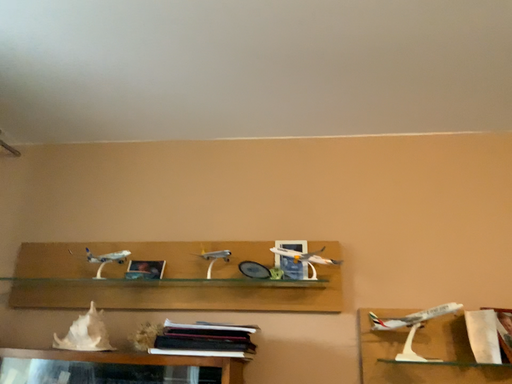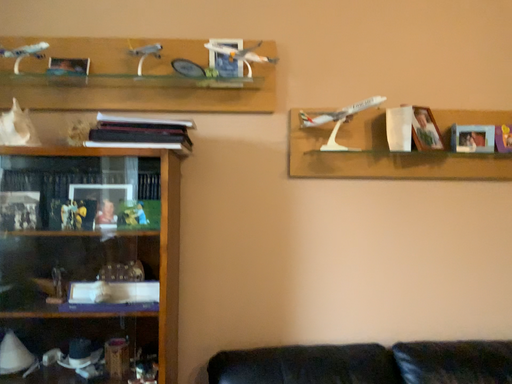
Question: How did the camera likely rotate when shooting the video?

Choices:
 (A) rotated right
 (B) rotated left

Answer: (A)